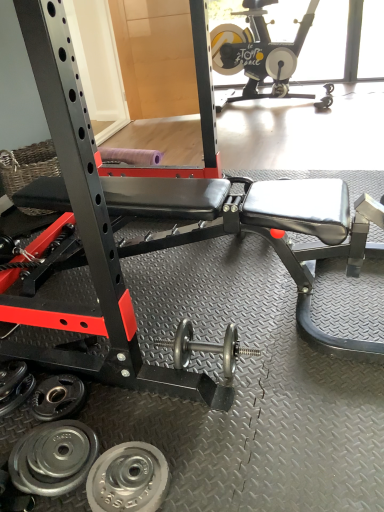
What are the coordinates of `free spot behind polished silver dumbbell at center` in the screenshot? It's located at (201, 322).